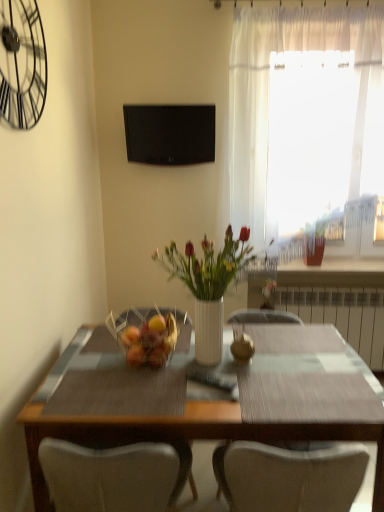
Find the location of `free point to the left of translucent glass basket at center`. free point to the left of translucent glass basket at center is located at coordinates (89, 366).